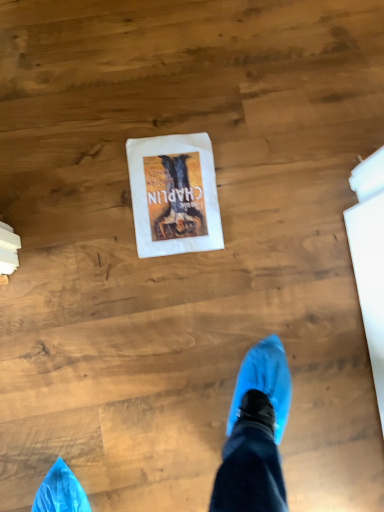
This screenshot has width=384, height=512. In order to click on vacant space situated on the left part of white paper at center in this screenshot , I will do `click(87, 165)`.